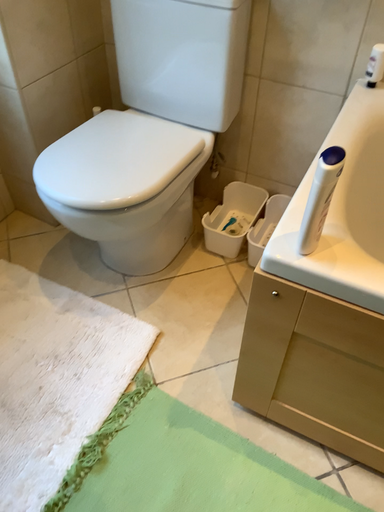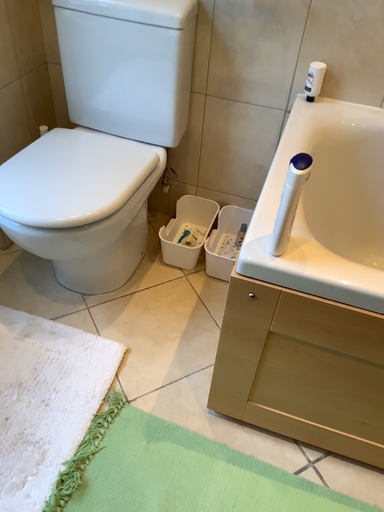
Question: Which way did the camera rotate in the video?

Choices:
 (A) rotated left
 (B) rotated right

Answer: (B)